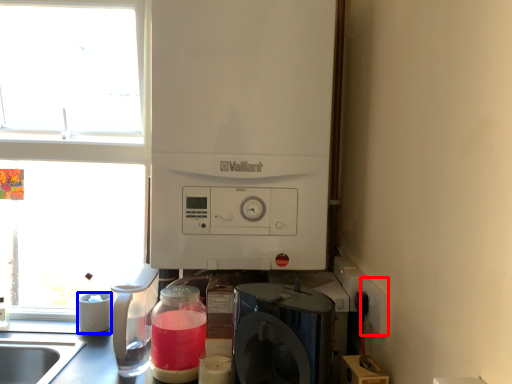
Question: Which object appears closest to the camera in this image, electric outlet (highlighted by a red box) or appliance (highlighted by a blue box)?

Choices:
 (A) electric outlet
 (B) appliance

Answer: (A)